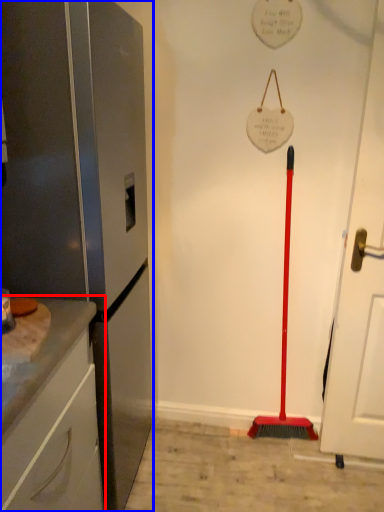
Question: Which object is further to the camera taking this photo, cabinetry (highlighted by a red box) or appliance (highlighted by a blue box)?

Choices:
 (A) cabinetry
 (B) appliance

Answer: (B)